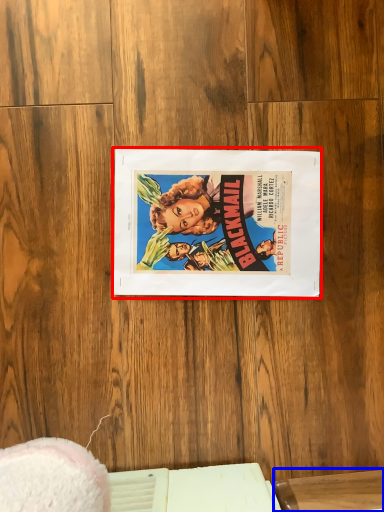
Question: Among these objects, which one is farthest to the camera, paperback book (highlighted by a red box) or table (highlighted by a blue box)?

Choices:
 (A) paperback book
 (B) table

Answer: (A)